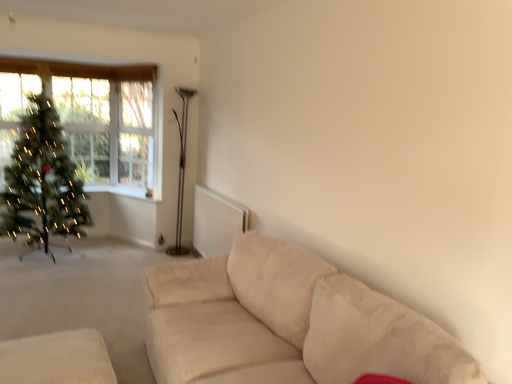
Question: Is clear glass window at upper left not close to green matte christmas tree at left?

Choices:
 (A) yes
 (B) no

Answer: (A)

Question: Is clear glass window at upper left to the left of green matte christmas tree at left from the viewer's perspective?

Choices:
 (A) yes
 (B) no

Answer: (B)

Question: Does clear glass window at upper left have a lesser width compared to green matte christmas tree at left?

Choices:
 (A) yes
 (B) no

Answer: (A)

Question: Is clear glass window at upper left in front of green matte christmas tree at left?

Choices:
 (A) no
 (B) yes

Answer: (A)

Question: From a real-world perspective, does clear glass window at upper left stand above green matte christmas tree at left?

Choices:
 (A) yes
 (B) no

Answer: (A)

Question: Does clear glass window at upper left have a greater height compared to green matte christmas tree at left?

Choices:
 (A) yes
 (B) no

Answer: (B)

Question: Is green matte christmas tree at left to the right of clear glass window at upper left from the viewer's perspective?

Choices:
 (A) no
 (B) yes

Answer: (A)

Question: Is green matte christmas tree at left at the left side of clear glass window at upper left?

Choices:
 (A) no
 (B) yes

Answer: (B)

Question: Can you confirm if green matte christmas tree at left is shorter than clear glass window at upper left?

Choices:
 (A) no
 (B) yes

Answer: (A)

Question: From a real-world perspective, is green matte christmas tree at left beneath clear glass window at upper left?

Choices:
 (A) yes
 (B) no

Answer: (A)

Question: Does green matte christmas tree at left lie behind clear glass window at upper left?

Choices:
 (A) yes
 (B) no

Answer: (B)

Question: Does green matte christmas tree at left have a smaller size compared to clear glass window at upper left?

Choices:
 (A) no
 (B) yes

Answer: (A)

Question: From the image's perspective, does metallic silver floor lamp at center appear lower than green matte christmas tree at left?

Choices:
 (A) no
 (B) yes

Answer: (B)